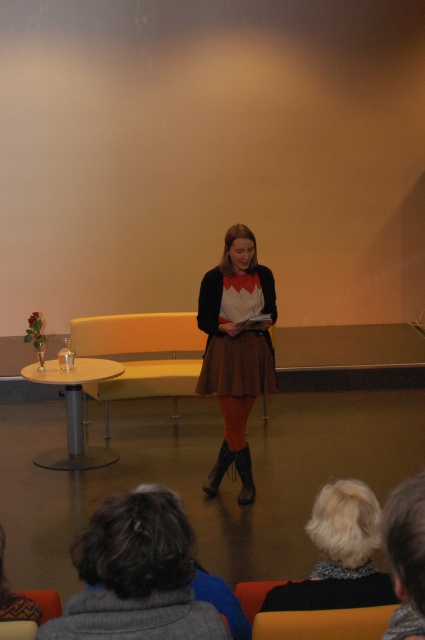
Question: Which object appears closest to the camera in this image?

Choices:
 (A) fluffy gray sweater at lower center
 (B) white fuzzy hair at upper center
 (C) matte brown skirt at center

Answer: (B)

Question: Does matte brown skirt at center appear on the left side of fluffy gray sweater at lower center?

Choices:
 (A) yes
 (B) no

Answer: (A)

Question: Observing the image, what is the correct spatial positioning of fluffy gray sweater at lower center in reference to brown textured skirt at center?

Choices:
 (A) above
 (B) below

Answer: (B)

Question: Is brown textured skirt at center to the right of white fuzzy hair at upper center from the viewer's perspective?

Choices:
 (A) yes
 (B) no

Answer: (B)

Question: Among these points, which one is nearest to the camera?

Choices:
 (A) (328, 540)
 (B) (399, 600)
 (C) (207, 346)

Answer: (B)

Question: Among these objects, which one is farthest from the camera?

Choices:
 (A) matte brown skirt at center
 (B) gray wool sweater at lower left
 (C) white fuzzy hair at upper center

Answer: (A)